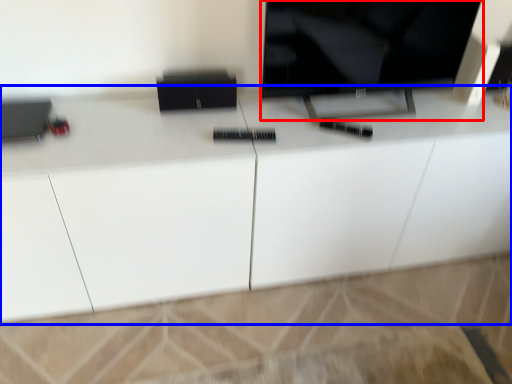
Question: Which point is further to the camera, television (highlighted by a red box) or cabinetry (highlighted by a blue box)?

Choices:
 (A) television
 (B) cabinetry

Answer: (A)